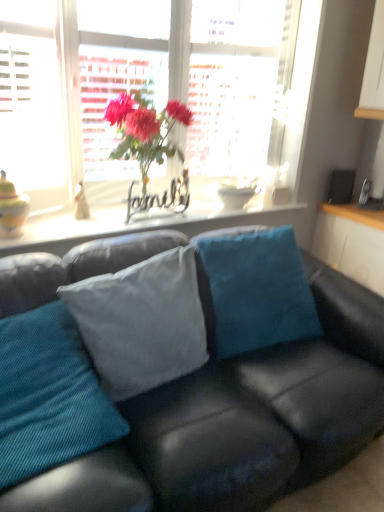
Measure the distance between point (368, 213) and camera.

A distance of 8.59 feet exists between point (368, 213) and camera.

What do you see at coordinates (352, 242) in the screenshot? I see `white glossy cabinet at right` at bounding box center [352, 242].

Image resolution: width=384 pixels, height=512 pixels. What do you see at coordinates (142, 322) in the screenshot? I see `light blue fabric pillow at center, marked as the second pillow in a left-to-right arrangement` at bounding box center [142, 322].

At what (x,y) coordinates should I click in order to perform the action: click on light blue fabric pillow at center, positioned as the second pillow in right-to-left order. Please return your answer as a coordinate pair (x, y). Image resolution: width=384 pixels, height=512 pixels. Looking at the image, I should click on (142, 322).

This screenshot has height=512, width=384. Identify the location of matte glass window at upper center. (74, 92).

Measure the distance between black leather couch at center and camera.

black leather couch at center is 1.04 meters away from camera.

The height and width of the screenshot is (512, 384). What do you see at coordinates (49, 396) in the screenshot?
I see `teal corduroy pillow at center, which appears as the 1th pillow when viewed from the left` at bounding box center [49, 396].

This screenshot has height=512, width=384. In order to click on white glossy cabinet at right in this screenshot , I will do `click(352, 242)`.

How many degrees apart are the facing directions of light blue fabric pillow at center, positioned as the second pillow in right-to-left order, and white glossy cabinet at right?

light blue fabric pillow at center, positioned as the second pillow in right-to-left order, and white glossy cabinet at right are facing 93.6 degrees away from each other.

Is light blue fabric pillow at center, positioned as the second pillow in right-to-left order, oriented away from white glossy cabinet at right?

No, light blue fabric pillow at center, positioned as the second pillow in right-to-left order, is not facing away from white glossy cabinet at right.

From the image's perspective, does light blue fabric pillow at center, positioned as the second pillow in right-to-left order, appear higher than white glossy cabinet at right?

No, from the image's perspective, light blue fabric pillow at center, positioned as the second pillow in right-to-left order, is not on top of white glossy cabinet at right.

Considering the sizes of objects teal corduroy pillow at center, which is counted as the 1th pillow, starting from the right, and white glossy cabinet at right in the image provided, who is smaller, teal corduroy pillow at center, which is counted as the 1th pillow, starting from the right, or white glossy cabinet at right?

white glossy cabinet at right is smaller.

From a real-world perspective, does teal corduroy pillow at center, which is counted as the 1th pillow, starting from the right, stand above white glossy cabinet at right?

Indeed, from a real-world perspective, teal corduroy pillow at center, which is counted as the 1th pillow, starting from the right, stands above white glossy cabinet at right.

How many degrees apart are the facing directions of teal corduroy pillow at center, acting as the 3th pillow starting from the left, and white glossy cabinet at right?

The facing directions of teal corduroy pillow at center, acting as the 3th pillow starting from the left, and white glossy cabinet at right are 75.6 degrees apart.

Is teal corduroy pillow at center, which is counted as the 1th pillow, starting from the right, placed right next to white glossy cabinet at right?

No.

Is matte glass vase at center oriented away from light blue fabric pillow at center, marked as the second pillow in a left-to-right arrangement?

No, matte glass vase at center is not facing away from light blue fabric pillow at center, marked as the second pillow in a left-to-right arrangement.

In the scene shown: Is matte glass vase at center taller or shorter than light blue fabric pillow at center, positioned as the second pillow in right-to-left order?

In the image, matte glass vase at center appears to be shorter than light blue fabric pillow at center, positioned as the second pillow in right-to-left order.

At what (x,y) coordinates should I click in order to perform the action: click on window sill behind the teal corduroy pillow at center, arranged as the 3th pillow when viewed from the right. Please return your answer as a coordinate pair (x, y). The height and width of the screenshot is (512, 384). Looking at the image, I should click on (146, 225).

Is teal corduroy pillow at center, which appears as the 1th pillow when viewed from the left, facing towards matte glass window sill at center?

No, teal corduroy pillow at center, which appears as the 1th pillow when viewed from the left, is not oriented towards matte glass window sill at center.

Considering the relative sizes of teal corduroy pillow at center, arranged as the 3th pillow when viewed from the right, and matte glass window sill at center in the image provided, is teal corduroy pillow at center, arranged as the 3th pillow when viewed from the right, bigger than matte glass window sill at center?

Correct, teal corduroy pillow at center, arranged as the 3th pillow when viewed from the right, is larger in size than matte glass window sill at center.

Can light blue fabric pillow at center, positioned as the second pillow in right-to-left order, be found inside matte yellow vase at left?

No, matte yellow vase at left does not contain light blue fabric pillow at center, positioned as the second pillow in right-to-left order.

Can you confirm if matte yellow vase at left is wider than light blue fabric pillow at center, positioned as the second pillow in right-to-left order?

No, matte yellow vase at left is not wider than light blue fabric pillow at center, positioned as the second pillow in right-to-left order.

Image resolution: width=384 pixels, height=512 pixels. What are the coordinates of `vase above the light blue fabric pillow at center, marked as the second pillow in a left-to-right arrangement (from the image's perspective)` in the screenshot? It's located at (12, 209).

How much distance is there between matte yellow vase at left and light blue fabric pillow at center, marked as the second pillow in a left-to-right arrangement?

30.64 inches.

Which object is positioned more to the right, matte glass window at upper center or teal corduroy pillow at center, arranged as the 3th pillow when viewed from the right?

matte glass window at upper center is more to the right.

Can you confirm if matte glass window at upper center is bigger than teal corduroy pillow at center, which appears as the 1th pillow when viewed from the left?

Yes.

Consider the image. Is matte glass window at upper center inside the boundaries of teal corduroy pillow at center, arranged as the 3th pillow when viewed from the right, or outside?

matte glass window at upper center is outside teal corduroy pillow at center, arranged as the 3th pillow when viewed from the right.

Is white glossy cabinet at right shorter than black leather couch at center?

Indeed, white glossy cabinet at right has a lesser height compared to black leather couch at center.

Based on their positions, is white glossy cabinet at right located to the left or right of black leather couch at center?

Based on their positions, white glossy cabinet at right is located to the right of black leather couch at center.

Where is `studio couch on the left side of white glossy cabinet at right`? studio couch on the left side of white glossy cabinet at right is located at coordinates (239, 422).

From the image's perspective, does white glossy cabinet at right appear higher than black leather couch at center?

Yes, from the image's perspective, white glossy cabinet at right is above black leather couch at center.

Identify the location of the 2nd pillow to the left when counting from the white glossy cabinet at right. The width and height of the screenshot is (384, 512). (142, 322).

At what (x,y) coordinates should I click in order to perform the action: click on dresser below the teal corduroy pillow at center, which is counted as the 1th pillow, starting from the right (from a real-world perspective). Please return your answer as a coordinate pair (x, y). Looking at the image, I should click on (352, 242).

From the image, which object appears to be nearer to matte glass vase at center, black leather couch at center or light blue fabric pillow at center, positioned as the second pillow in right-to-left order?

The object closer to matte glass vase at center is light blue fabric pillow at center, positioned as the second pillow in right-to-left order.

From the image, which object appears to be nearer to black leather couch at center, teal corduroy pillow at center, which is counted as the 1th pillow, starting from the right, or light blue fabric pillow at center, marked as the second pillow in a left-to-right arrangement?

teal corduroy pillow at center, which is counted as the 1th pillow, starting from the right, lies closer to black leather couch at center than the other object.

Which object lies nearer to the anchor point teal corduroy pillow at center, arranged as the 3th pillow when viewed from the right, black leather couch at center or matte glass window sill at center?

The object closer to teal corduroy pillow at center, arranged as the 3th pillow when viewed from the right, is black leather couch at center.

From the image, which object appears to be nearer to matte glass vase at center, matte glass window sill at center or light blue fabric pillow at center, marked as the second pillow in a left-to-right arrangement?

The object closer to matte glass vase at center is matte glass window sill at center.

Based on their spatial positions, is teal corduroy pillow at center, which appears as the 1th pillow when viewed from the left, or matte glass vase at center closer to black leather couch at center?

teal corduroy pillow at center, which appears as the 1th pillow when viewed from the left.

When comparing their distances from white glossy cabinet at right, does light blue fabric pillow at center, positioned as the second pillow in right-to-left order, or matte glass window sill at center seem closer?

matte glass window sill at center.

Considering their positions, is matte glass vase at center positioned further to teal corduroy pillow at center, which appears as the 1th pillow when viewed from the left, than matte glass window sill at center?

matte glass vase at center is further to teal corduroy pillow at center, which appears as the 1th pillow when viewed from the left.

From the image, which object appears to be farther from light blue fabric pillow at center, positioned as the second pillow in right-to-left order, teal corduroy pillow at center, which is counted as the 1th pillow, starting from the right, or matte glass window at upper center?

matte glass window at upper center.

Find the location of a particular element. The width and height of the screenshot is (384, 512). vase between matte glass window at upper center and teal corduroy pillow at center, which appears as the 1th pillow when viewed from the left, vertically is located at coordinates (12, 209).

The width and height of the screenshot is (384, 512). In order to click on vase between black leather couch at center and matte glass window sill at center along the z-axis in this screenshot , I will do `click(12, 209)`.

The image size is (384, 512). Identify the location of studio couch situated between matte yellow vase at left and teal corduroy pillow at center, acting as the 3th pillow starting from the left, from left to right. [239, 422].

The image size is (384, 512). I want to click on vase positioned between teal corduroy pillow at center, which appears as the 1th pillow when viewed from the left, and matte glass window sill at center from near to far, so click(12, 209).